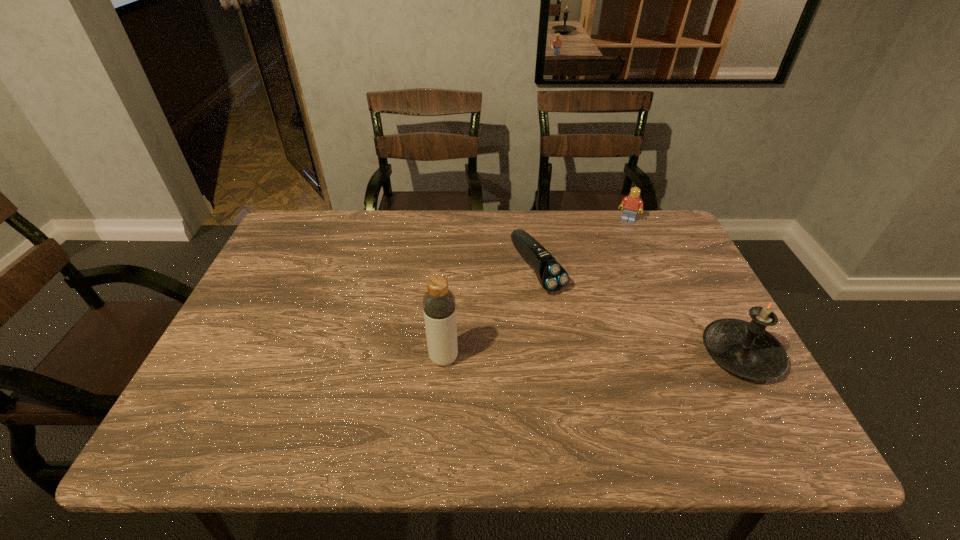
What are the coordinates of `the tallest object` in the screenshot? It's located at (439, 307).

Where is `the leftmost object`? the leftmost object is located at coordinates (439, 307).

You are a GUI agent. You are given a task and a screenshot of the screen. Output one action in this format:
    pyautogui.click(x=<x>, y=<y>)
    Task: Click on the candle
    The height and width of the screenshot is (540, 960).
    Given the screenshot: What is the action you would take?
    pyautogui.click(x=746, y=349)

The height and width of the screenshot is (540, 960). I want to click on the second object from left to right, so click(x=551, y=275).

Locate an element on the screen. This screenshot has width=960, height=540. the shortest object is located at coordinates (551, 275).

The height and width of the screenshot is (540, 960). Identify the location of Lego. tap(632, 203).

In order to click on the farthest object in this screenshot , I will do `click(632, 203)`.

Where is `free region located 0.250m on the back of the leftmost object`? The image size is (960, 540). free region located 0.250m on the back of the leftmost object is located at coordinates (450, 276).

At what (x,y) coordinates should I click in order to perform the action: click on vacant space located 0.130m on the back of the candle. Please return your answer as a coordinate pair (x, y). The height and width of the screenshot is (540, 960). Looking at the image, I should click on [x=705, y=289].

The image size is (960, 540). I want to click on free space located 0.180m on the head of the third nearest object, so click(x=594, y=343).